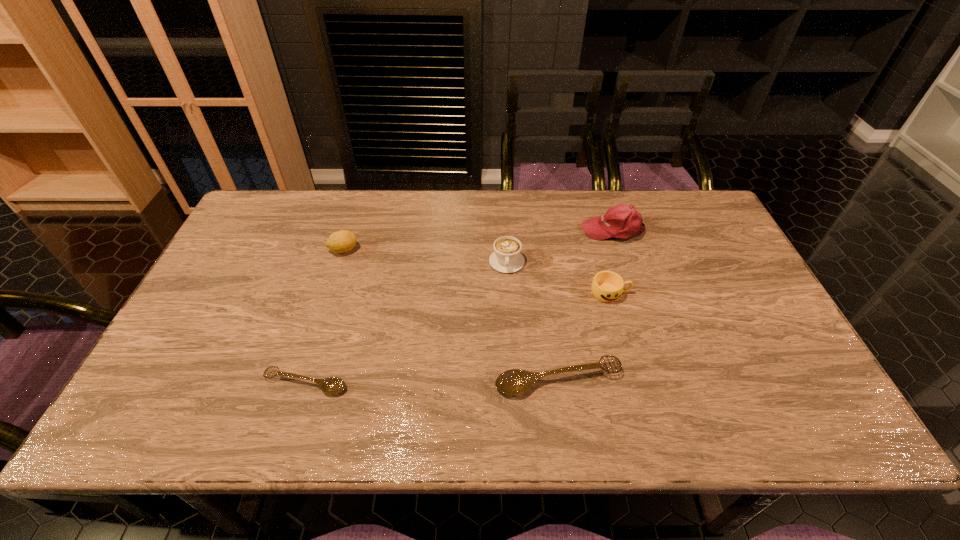
Locate an element on the screen. The height and width of the screenshot is (540, 960). free space at the left edge of the desktop is located at coordinates (220, 262).

The image size is (960, 540). In the image, there is a desktop. What are the coordinates of `vacant space at the right edge` in the screenshot? It's located at (738, 273).

Locate an element on the screen. The height and width of the screenshot is (540, 960). vacant space at the far left corner of the desktop is located at coordinates (286, 224).

At what (x,y) coordinates should I click in order to perform the action: click on free space between the baseball cap and the third nearest object. Please return your answer as a coordinate pair (x, y). Looking at the image, I should click on (612, 261).

Locate an element on the screen. This screenshot has height=540, width=960. free space between the lemon and the right ladle is located at coordinates (451, 315).

Locate an element on the screen. vacant space that's between the lemon and the taller ladle is located at coordinates (451, 315).

Where is `blank region between the tallest object and the shortest object`? The width and height of the screenshot is (960, 540). blank region between the tallest object and the shortest object is located at coordinates (460, 307).

Locate an element on the screen. The width and height of the screenshot is (960, 540). vacant area between the cappuccino and the tallest object is located at coordinates (560, 246).

This screenshot has height=540, width=960. What are the coordinates of `free space between the cappuccino and the right ladle` in the screenshot? It's located at (533, 321).

At what (x,y) coordinates should I click in order to perform the action: click on vacant space in between the cappuccino and the shortest object. Please return your answer as a coordinate pair (x, y). The height and width of the screenshot is (540, 960). Looking at the image, I should click on (406, 323).